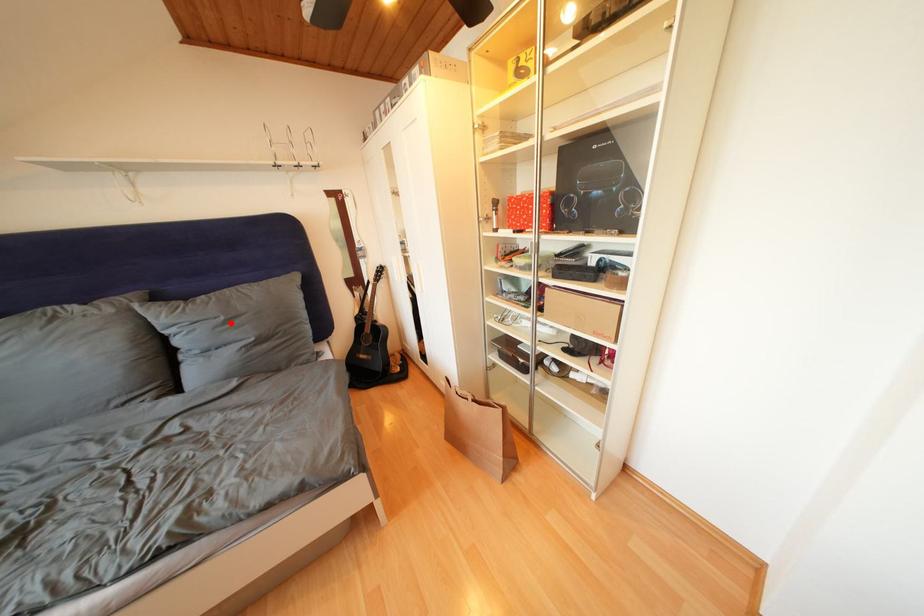
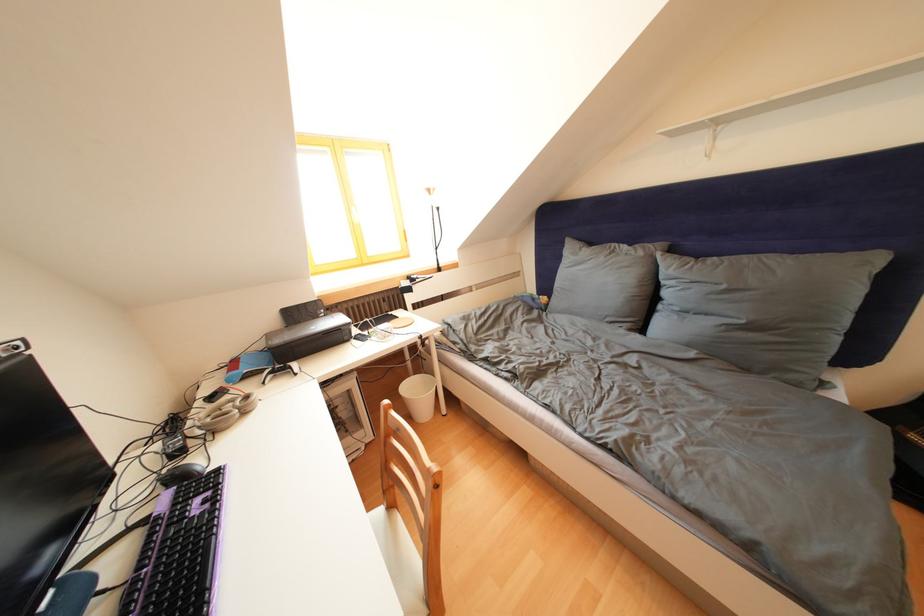
Find the pixel in the second image that matches the highlighted location in the first image.

(733, 292)